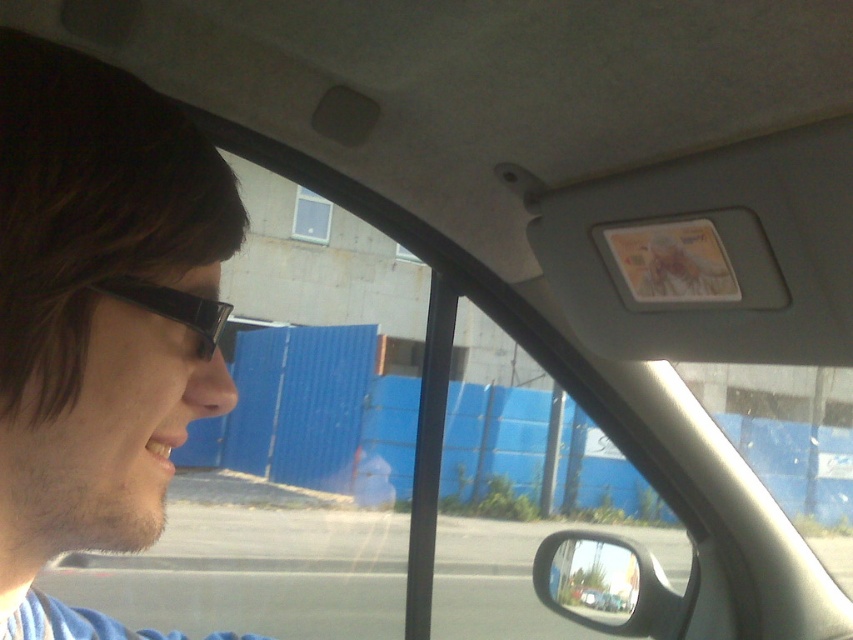
Does brown matte hair at upper left have a lesser height compared to black plastic glasses at left?

No.

Which is above, brown matte hair at upper left or black plastic glasses at left?

black plastic glasses at left is higher up.

Which is behind, point (212, 186) or point (201, 328)?

Point (212, 186)

Where is `brown matte hair at upper left`? This screenshot has height=640, width=853. brown matte hair at upper left is located at coordinates (99, 316).

Is glossy black side mirror at lower right taller than black plastic glasses at left?

Indeed, glossy black side mirror at lower right has a greater height compared to black plastic glasses at left.

Who is more distant from viewer, [570,561] or [169,307]?

The point [570,561] is behind.

Identify the location of glossy black side mirror at lower right. (605, 584).

Which is more to the right, brown matte hair at upper left or glossy black side mirror at lower right?

glossy black side mirror at lower right is more to the right.

Describe the element at coordinates (99, 316) in the screenshot. I see `brown matte hair at upper left` at that location.

This screenshot has height=640, width=853. In order to click on brown matte hair at upper left in this screenshot , I will do `click(99, 316)`.